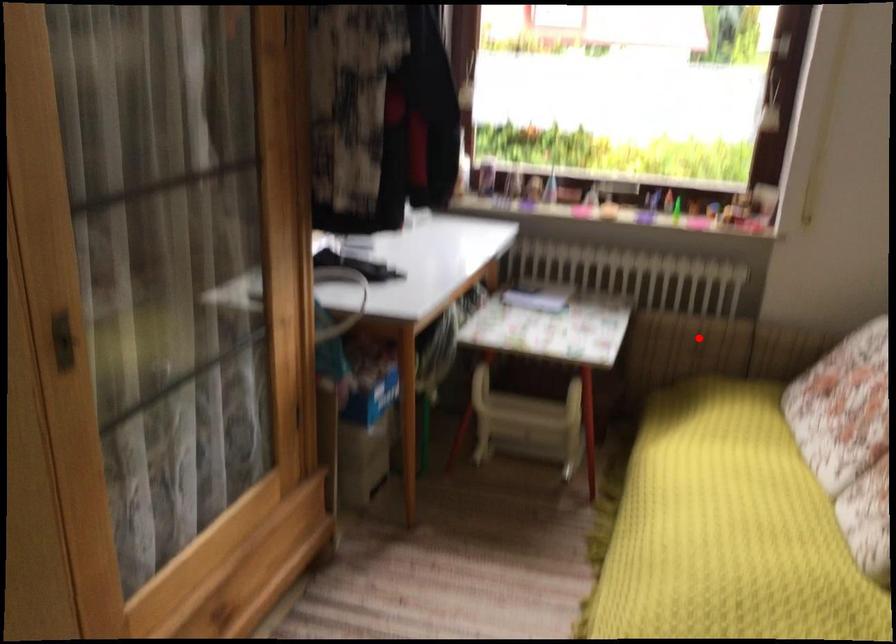
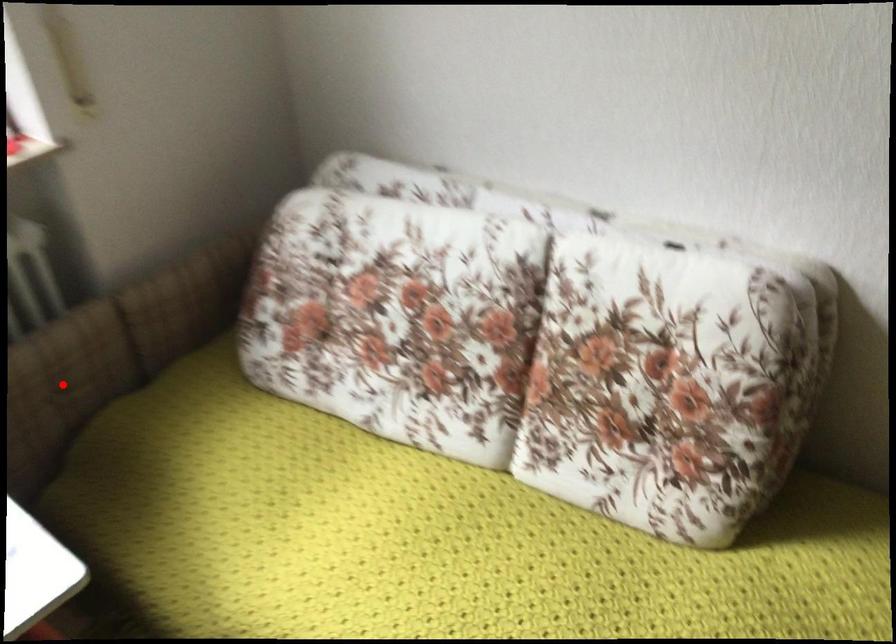
I am providing you with two images of the same scene from different viewpoints. A red point is marked on the first image and another point is marked on the second image. Does the point marked in image1 correspond to the same location as the one in image2?

Yes